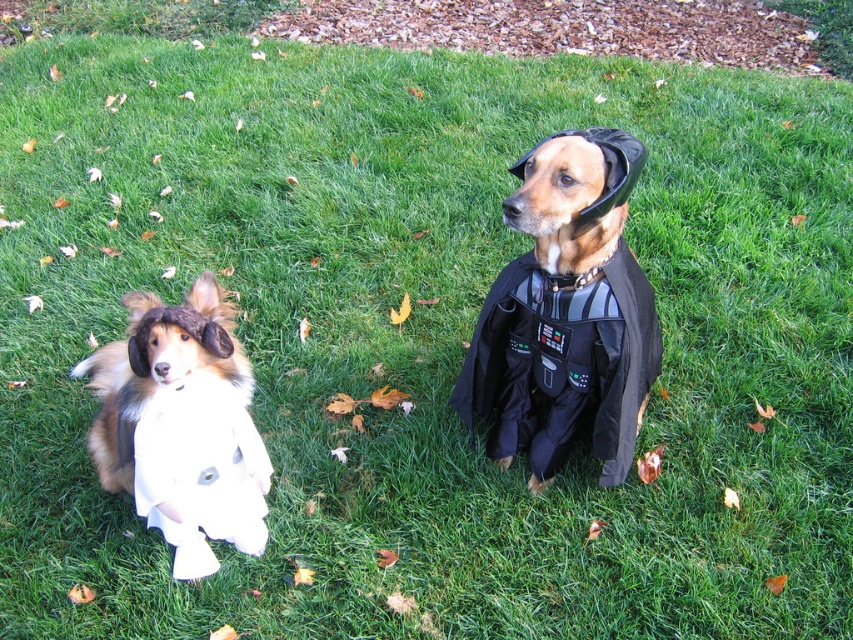
You are a photographer setting up for a photoshoot with two dogs wearing costumes. The scene includes a white soft ghost at left and a white fabric dress at left. Which costume is positioned more to the left side of the image?

The white soft ghost at left is positioned more to the left side of the image compared to the white fabric dress at left, as it is located to the left of the dress.

You are a photographer setting up a shoot for a pet photoshoot. You have two dogs wearing costumes. The black matte costume at center and the white fabric dress at left. You need to position them side by side so that their costumes don not overlap. Based on the scene description, which costume should be placed closer to the camera to prevent overlapping?

The white fabric dress at left should be placed closer to the camera because the black matte costume at center might be wider than the white fabric dress at left, so positioning the narrower one closer will help prevent overlap.